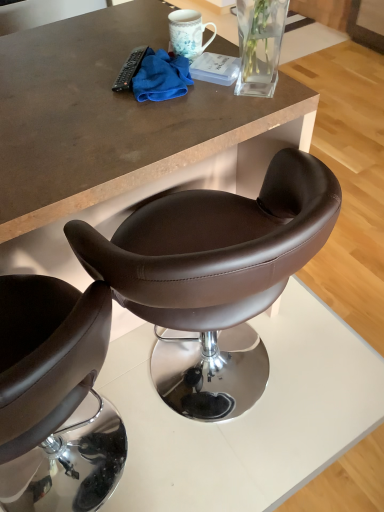
At what (x,y) coordinates should I click in order to perform the action: click on matte brown leather stool at center. Please return your answer as a coordinate pair (x, y). Image resolution: width=384 pixels, height=512 pixels. Looking at the image, I should click on (108, 116).

What do you see at coordinates (130, 69) in the screenshot? I see `black plastic remote control at upper center` at bounding box center [130, 69].

What is the approximate height of black plastic remote control at upper center?

black plastic remote control at upper center is 1.44 inches tall.

Identify the location of brown leather chair at center. Image resolution: width=384 pixels, height=512 pixels. (214, 273).

Is brown leather chair at center oriented away from matte brown leather stool at center?

brown leather chair at center does not have its back to matte brown leather stool at center.

From a real-world perspective, is brown leather chair at center on top of matte brown leather stool at center?

No, from a real-world perspective, brown leather chair at center is not above matte brown leather stool at center.

In the image, is brown leather chair at center positioned in front of or behind matte brown leather stool at center?

brown leather chair at center is positioned closer to the viewer than matte brown leather stool at center.

Does point (90, 257) come closer to viewer compared to point (208, 96)?

Yes, it is.

Do you think black plastic remote control at upper center is within brown leather chair at center, or outside of it?

The correct answer is: outside.

Between black plastic remote control at upper center and brown leather chair at center, which one has larger width?

brown leather chair at center.

Considering the positions of objects matte brown leather stool at center and black plastic remote control at upper center in the image provided, who is in front, matte brown leather stool at center or black plastic remote control at upper center?

matte brown leather stool at center is in front.

Can you tell me how much matte brown leather stool at center and black plastic remote control at upper center differ in facing direction?

There is a 136-degree angle between the facing directions of matte brown leather stool at center and black plastic remote control at upper center.

Who is smaller, matte brown leather stool at center or black plastic remote control at upper center?

With smaller size is black plastic remote control at upper center.

Is matte brown leather stool at center completely or partially outside of black plastic remote control at upper center?

matte brown leather stool at center is positioned outside black plastic remote control at upper center.

You are a GUI agent. You are given a task and a screenshot of the screen. Output one action in this format:
    pyautogui.click(x=<x>, y=<y>)
    Task: Click on the material that appears above the matte brown leather stool at center (from the image's perspective)
    This screenshot has width=384, height=512.
    Given the screenshot: What is the action you would take?
    pyautogui.click(x=161, y=77)

Between blue microfiber cloth at upper center and matte brown leather stool at center, which one appears on the left side from the viewer's perspective?

matte brown leather stool at center is more to the left.

Which is in front, blue microfiber cloth at upper center or matte brown leather stool at center?

matte brown leather stool at center.

Considering the sizes of objects blue microfiber cloth at upper center and matte brown leather stool at center in the image provided, who is taller, blue microfiber cloth at upper center or matte brown leather stool at center?

Standing taller between the two is matte brown leather stool at center.

Would you say blue microfiber cloth at upper center is part of matte brown leather stool at center's contents?

No, matte brown leather stool at center does not contain blue microfiber cloth at upper center.

What's the angular difference between matte brown leather stool at center and blue microfiber cloth at upper center's facing directions?

136 degrees separate the facing orientations of matte brown leather stool at center and blue microfiber cloth at upper center.

Does point (300, 110) lie behind point (146, 72)?

That is False.

From the picture: Is matte brown leather stool at center not near blue microfiber cloth at upper center?

No, matte brown leather stool at center is not far away from blue microfiber cloth at upper center.

Does blue microfiber cloth at upper center come behind brown leather chair at center?

Yes, blue microfiber cloth at upper center is behind brown leather chair at center.

Is blue microfiber cloth at upper center in contact with brown leather chair at center?

No.

Visually, is blue microfiber cloth at upper center positioned to the left or to the right of brown leather chair at center?

Clearly, blue microfiber cloth at upper center is on the left of brown leather chair at center in the image.

In the scene shown: From the image's perspective, is blue microfiber cloth at upper center positioned above or below brown leather chair at center?

From the image's perspective, blue microfiber cloth at upper center appears above brown leather chair at center.

Consider the image. Is blue microfiber cloth at upper center aimed at black plastic remote control at upper center?

Yes, blue microfiber cloth at upper center is oriented towards black plastic remote control at upper center.

Considering the points (169, 85) and (124, 76), which point is behind, point (169, 85) or point (124, 76)?

Positioned behind is point (124, 76).

Is blue microfiber cloth at upper center located outside black plastic remote control at upper center?

That's correct, blue microfiber cloth at upper center is outside of black plastic remote control at upper center.

At what (x,y) coordinates should I click in order to perform the action: click on remote control located above the blue microfiber cloth at upper center (from the image's perspective). Please return your answer as a coordinate pair (x, y). This screenshot has height=512, width=384. Looking at the image, I should click on (130, 69).

Where is `chair in front of the matte brown leather stool at center`? chair in front of the matte brown leather stool at center is located at coordinates (214, 273).

Find the location of a particular element. This screenshot has height=512, width=384. chair below the black plastic remote control at upper center (from a real-world perspective) is located at coordinates (214, 273).

Considering their positions, is matte brown leather stool at center positioned further to black plastic remote control at upper center than brown leather chair at center?

brown leather chair at center is positioned further to the anchor black plastic remote control at upper center.

When comparing their distances from blue microfiber cloth at upper center, does brown leather chair at center or matte brown leather stool at center seem further?

brown leather chair at center.

Looking at this image, estimate the real-world distances between objects in this image. Which object is further from blue microfiber cloth at upper center, matte brown leather stool at center or brown leather chair at center?

Among the two, brown leather chair at center is located further to blue microfiber cloth at upper center.

From the image, which object appears to be nearer to matte brown leather stool at center, blue microfiber cloth at upper center or brown leather chair at center?

blue microfiber cloth at upper center.

When comparing their distances from brown leather chair at center, does blue microfiber cloth at upper center or matte brown leather stool at center seem closer?

matte brown leather stool at center is closer to brown leather chair at center.

Considering their positions, is black plastic remote control at upper center positioned closer to matte brown leather stool at center than blue microfiber cloth at upper center?

Among the two, blue microfiber cloth at upper center is located nearer to matte brown leather stool at center.

From the picture: Based on their spatial positions, is matte brown leather stool at center or black plastic remote control at upper center closer to brown leather chair at center?

Based on the image, matte brown leather stool at center appears to be nearer to brown leather chair at center.

Based on their spatial positions, is black plastic remote control at upper center or blue microfiber cloth at upper center closer to brown leather chair at center?

The object closer to brown leather chair at center is blue microfiber cloth at upper center.

Locate an element on the screen. material between black plastic remote control at upper center and matte brown leather stool at center in the up-down direction is located at coordinates (161, 77).

Find the location of a particular element. desk between blue microfiber cloth at upper center and brown leather chair at center in the up-down direction is located at coordinates (108, 116).

The image size is (384, 512). Identify the location of material that lies between black plastic remote control at upper center and brown leather chair at center from top to bottom. (161, 77).

Locate an element on the screen. Image resolution: width=384 pixels, height=512 pixels. desk between black plastic remote control at upper center and brown leather chair at center vertically is located at coordinates (108, 116).